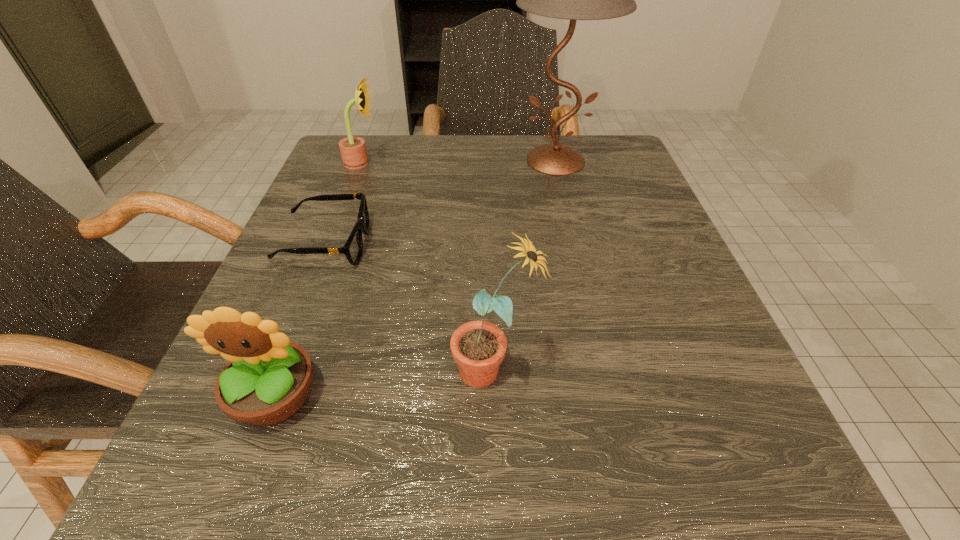
I want to click on blank space located 0.340m on the face of the farthest sunflower, so click(x=536, y=163).

Find the location of `vacant area situated 0.250m on the front-facing side of the third nearest object`. vacant area situated 0.250m on the front-facing side of the third nearest object is located at coordinates (513, 244).

Locate an element on the screen. The height and width of the screenshot is (540, 960). table lamp situated at the far edge is located at coordinates (574, 0).

You are a GUI agent. You are given a task and a screenshot of the screen. Output one action in this format:
    pyautogui.click(x=<x>, y=<y>)
    Task: Click on the sunflower situated at the far edge
    The height and width of the screenshot is (540, 960).
    Given the screenshot: What is the action you would take?
    pyautogui.click(x=353, y=151)

I want to click on object that is at the near edge, so click(267, 379).

Image resolution: width=960 pixels, height=540 pixels. I want to click on sunglasses located in the left edge section of the desktop, so click(353, 248).

You are a GUI agent. You are given a task and a screenshot of the screen. Output one action in this format:
    pyautogui.click(x=<x>, y=<y>)
    Task: Click on the object situated at the right edge
    The image size is (960, 540).
    Given the screenshot: What is the action you would take?
    pyautogui.click(x=574, y=0)

Where is `object that is at the far left corner`? The height and width of the screenshot is (540, 960). object that is at the far left corner is located at coordinates (353, 151).

At what (x,y) coordinates should I click in order to perform the action: click on object at the near left corner. Please return your answer as a coordinate pair (x, y). This screenshot has width=960, height=540. Looking at the image, I should click on (267, 379).

Locate an element on the screen. This screenshot has width=960, height=540. object at the far right corner is located at coordinates (574, 0).